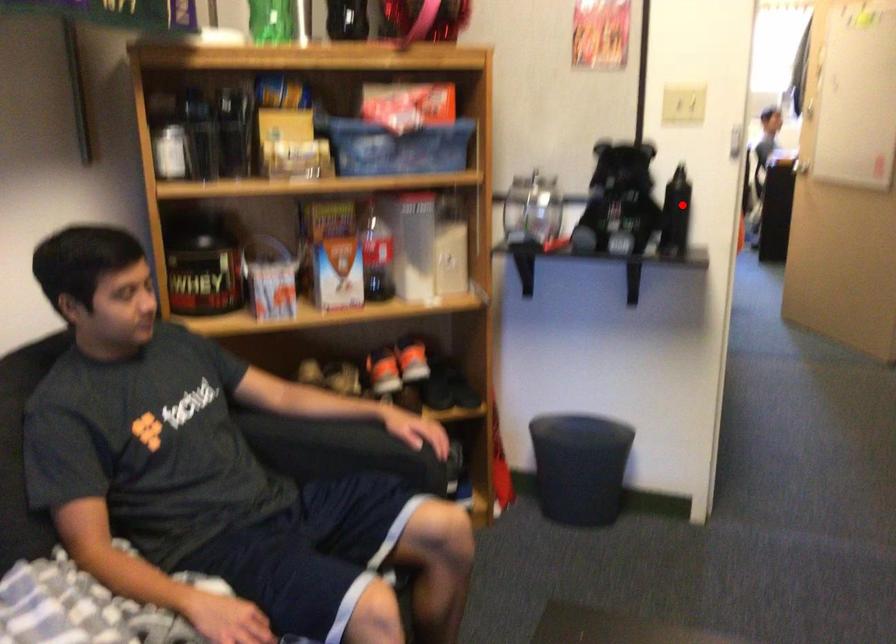
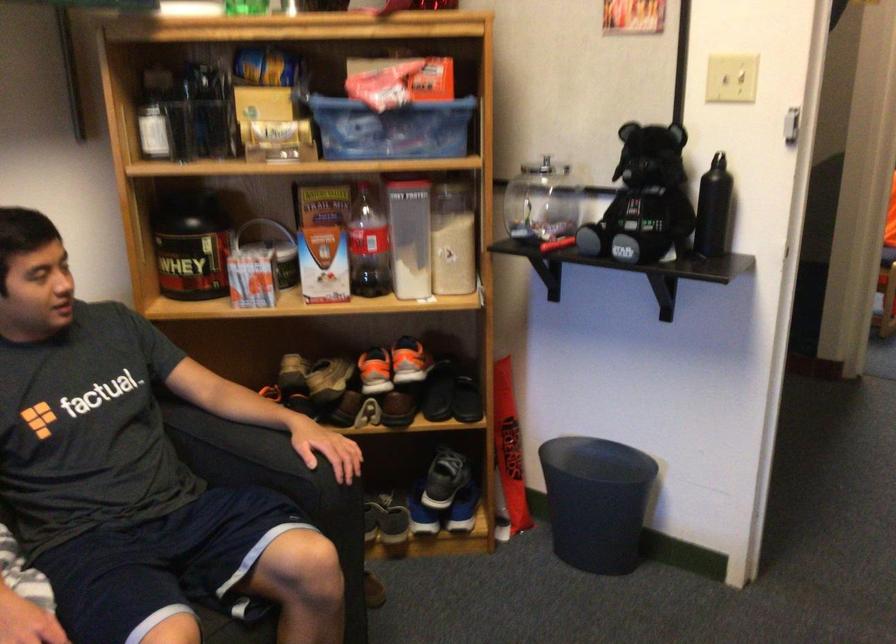
Question: I am providing you with two images of the same scene from different viewpoints. A red point is shown in image1. For the corresponding object point in image2, is it positioned nearer or farther from the camera?

Choices:
 (A) Nearer
 (B) Farther

Answer: (A)